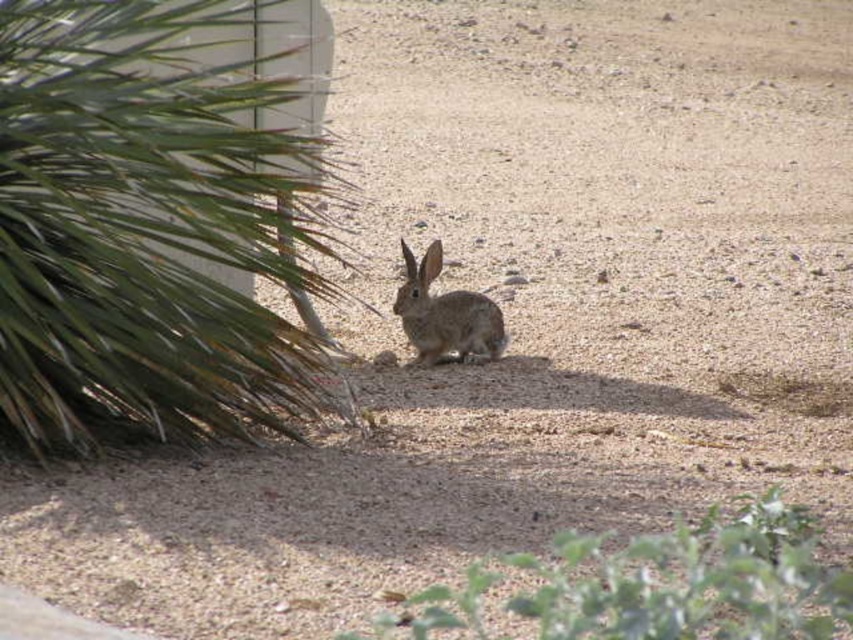
You are a desert explorer who needs to find shade. You see a rabbit sitting between the green leafy plant at left and the green leafy plant at lower right. Which plant is closer to the rabbit?

The green leafy plant at lower right is closer to the rabbit because the green leafy plant at left is positioned over it, meaning the lower right plant is beneath and thus nearer to the rabbit.

You are a desert explorer who needs to find shelter. You see a green leafy plant at lower right and a furry brown rabbit at center. Which object is closer to your right side when facing the scene?

The green leafy plant at lower right is positioned on the right side of the furry brown rabbit at center, so it is closer to your right side when facing the scene.